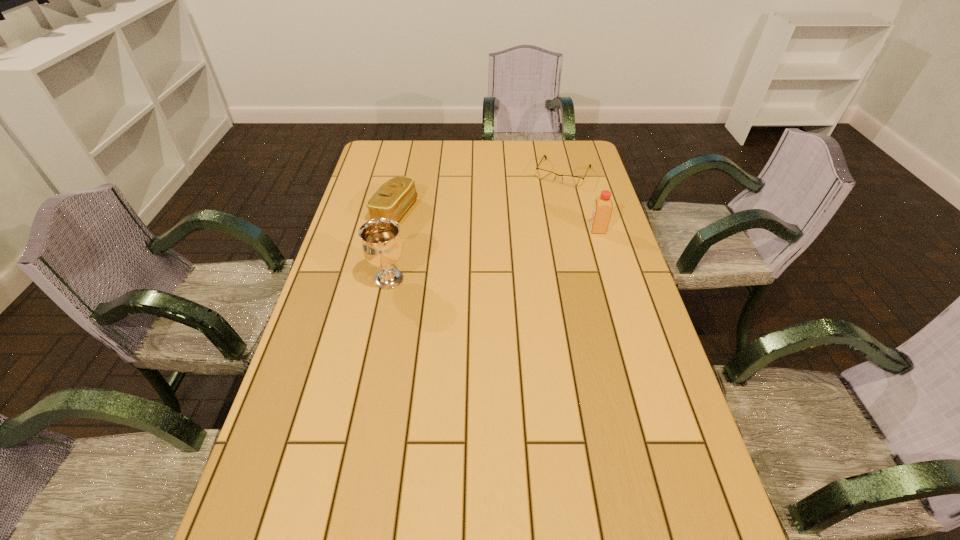
You are a GUI agent. You are given a task and a screenshot of the screen. Output one action in this format:
    pyautogui.click(x=<x>, y=<y>)
    Task: Click on the spectacles situated at the right edge
    This screenshot has width=960, height=540.
    Given the screenshot: What is the action you would take?
    pyautogui.click(x=573, y=181)

The height and width of the screenshot is (540, 960). What are the coordinates of `object that is at the far right corner` in the screenshot? It's located at (573, 181).

The width and height of the screenshot is (960, 540). What are the coordinates of `vacant space at the far edge of the desktop` in the screenshot? It's located at (518, 146).

In the image, there is a desktop. At what (x,y) coordinates should I click in order to perform the action: click on vacant space at the near edge. Please return your answer as a coordinate pair (x, y). This screenshot has height=540, width=960. Looking at the image, I should click on (526, 480).

In the image, there is a desktop. Where is `vacant space at the left edge`? This screenshot has width=960, height=540. vacant space at the left edge is located at coordinates (370, 269).

In the image, there is a desktop. Identify the location of vacant space at the right edge. (631, 359).

At what (x,y) coordinates should I click in order to perform the action: click on vacant space at the far left corner of the desktop. Please return your answer as a coordinate pair (x, y). Image resolution: width=960 pixels, height=540 pixels. Looking at the image, I should click on (371, 147).

This screenshot has width=960, height=540. What are the coordinates of `free space at the far right corner of the desktop` in the screenshot? It's located at (591, 166).

This screenshot has height=540, width=960. I want to click on vacant space at the near right corner, so click(704, 485).

Identify the location of vacant point located between the third shortest object and the second shortest object. (496, 221).